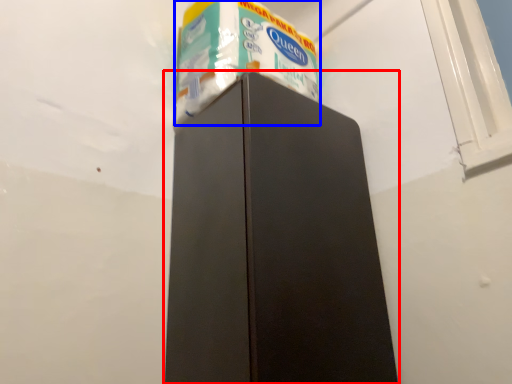
Question: Which object is closer to the camera taking this photo, refrigerator (highlighted by a red box) or toilet paper (highlighted by a blue box)?

Choices:
 (A) refrigerator
 (B) toilet paper

Answer: (A)